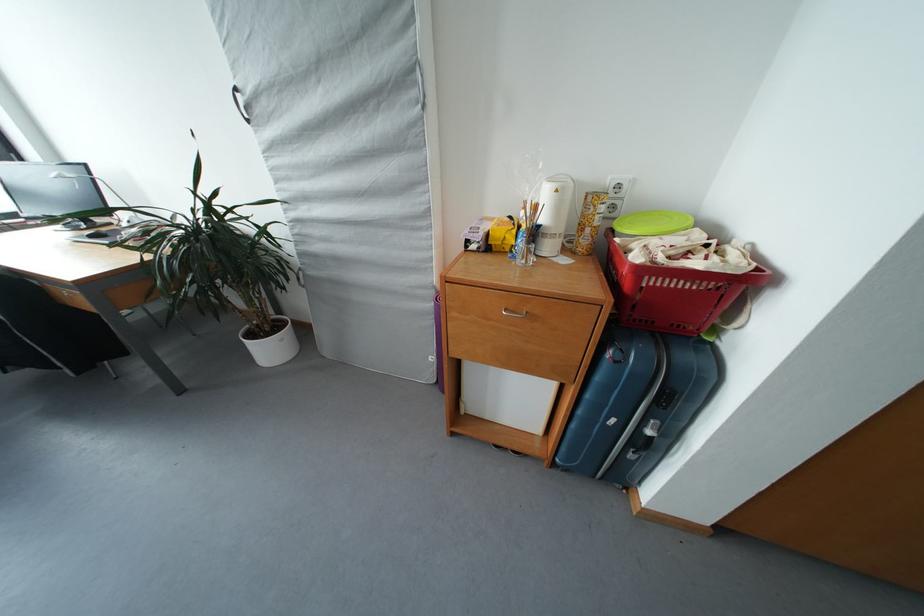
Find where to pull the black suitcase handle. Please return your answer as a coordinate pair (x, y).

(636, 403)